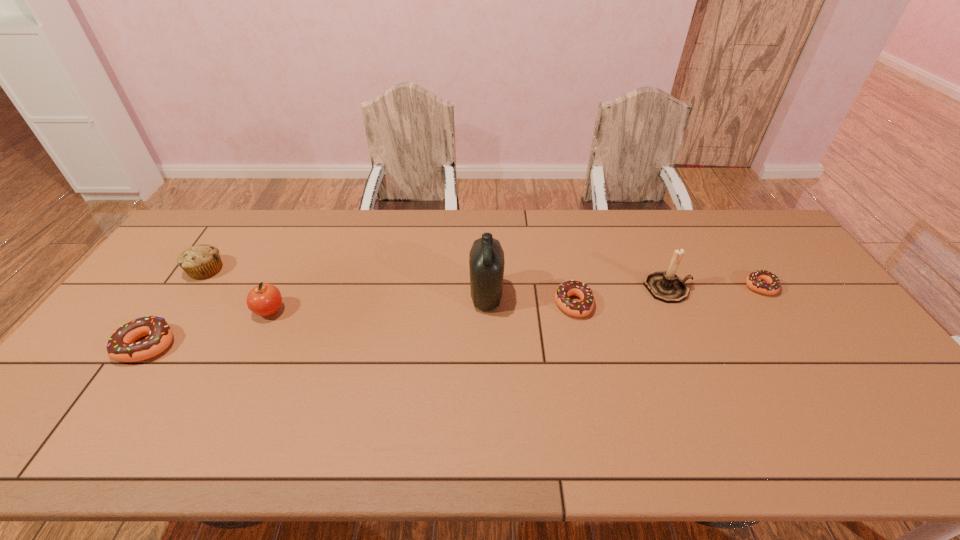
Please point a location where one more doughnut can be added evenly. Please provide its 2D coordinates. Your answer should be formatted as a tuple, i.e. [(x, y)], where the tuple contains the x and y coordinates of a point satisfying the conditions above.

[(370, 323)]